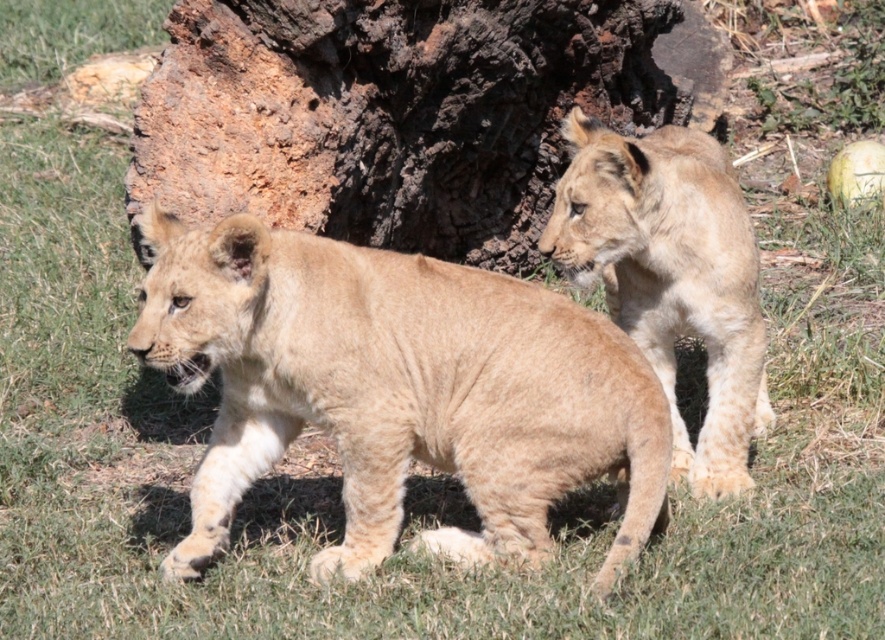
You are a wildlife photographer positioned at the origin point of the image. You want to capture a photo of the fuzzy beige lion cub at center. According to the coordinates provided, in which direction should you aim your camera to ensure the cub is centered in your shot?

The fuzzy beige lion cub at center is located at coordinates point 0.608 on the x axis and 0.450 on the y axis. Since the origin point is at the bottom left corner of the image, you should aim your camera to the upper right direction to center the cub in your shot.

You are a wildlife photographer observing two lion cubs in the grass. You notice the fuzzy beige lion cub at center and the light brown fur at right. Which cub is positioned more to the left?

The fuzzy beige lion cub at center is positioned more to the left than the light brown fur at right.

You are a wildlife photographer observing two lion cubs in the savanna. You notice the fuzzy beige lion cub at center and the light brown fur at right. Which lion cub is bigger in size?

The fuzzy beige lion cub at center is larger in size compared to the light brown fur at right.